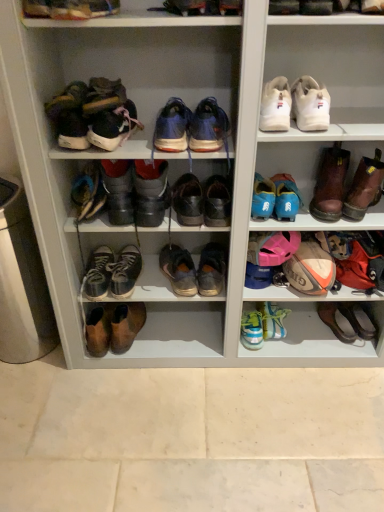
The height and width of the screenshot is (512, 384). In order to click on vacant region to the right of light blue synthetic sneakers at lower center, which ranks as the seventh shoe in left-to-right order in this screenshot , I will do `click(305, 344)`.